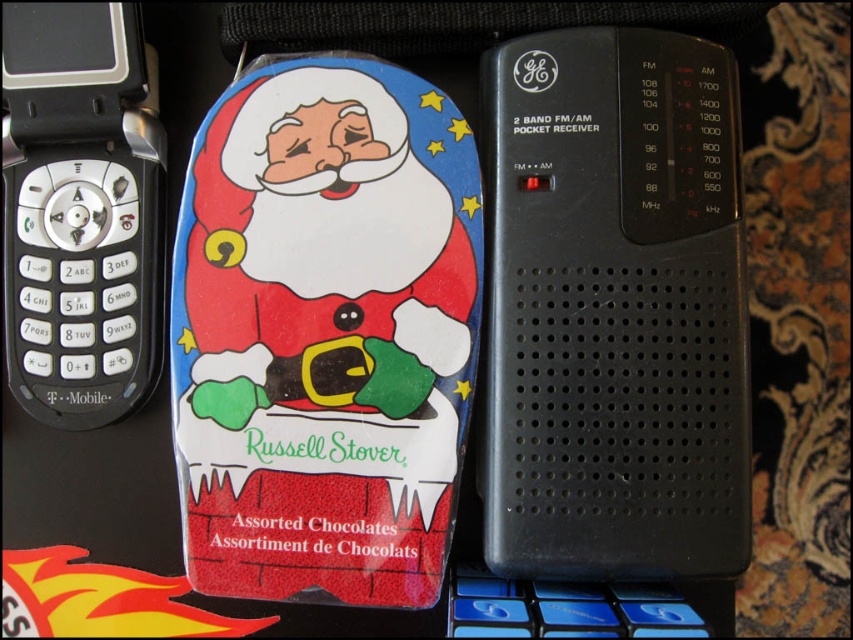
Question: Among these points, which one is nearest to the camera?

Choices:
 (A) (332, 54)
 (B) (140, 147)
 (C) (717, 220)

Answer: (C)

Question: Based on their relative distances, which object is farther from the glossy plastic santa claus at center?

Choices:
 (A) black plastic radio at center right
 (B) black plastic flip phone at left

Answer: (B)

Question: Does glossy plastic santa claus at center appear on the right side of black plastic radio at center right?

Choices:
 (A) yes
 (B) no

Answer: (B)

Question: Can you confirm if glossy plastic santa claus at center is positioned to the left of black plastic flip phone at left?

Choices:
 (A) yes
 (B) no

Answer: (B)

Question: Which point is closer to the camera?

Choices:
 (A) black plastic radio at center right
 (B) glossy plastic santa claus at center
 (C) black plastic flip phone at left

Answer: (A)

Question: In this image, where is black plastic radio at center right located relative to black plastic flip phone at left?

Choices:
 (A) above
 (B) below

Answer: (B)